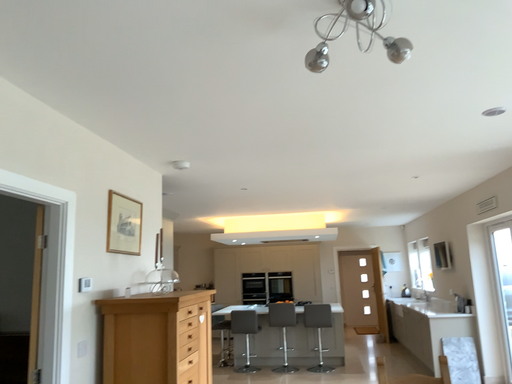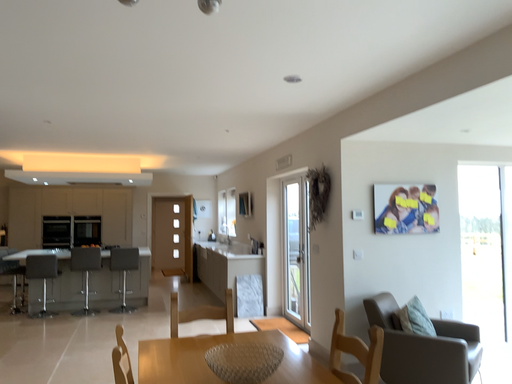
Question: How did the camera likely rotate when shooting the video?

Choices:
 (A) rotated left
 (B) rotated right

Answer: (B)